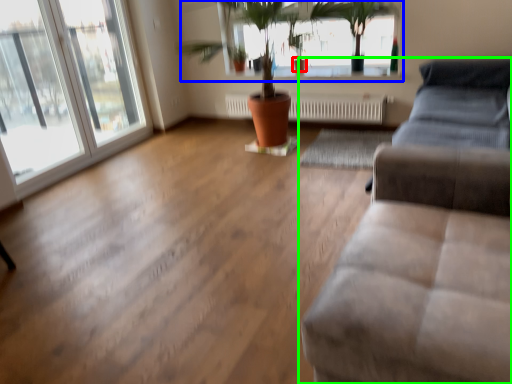
Question: Considering the real-world distances, which object is closest to flowerpot (highlighted by a red box)? bay window (highlighted by a blue box) or studio couch (highlighted by a green box).

Choices:
 (A) bay window
 (B) studio couch

Answer: (A)